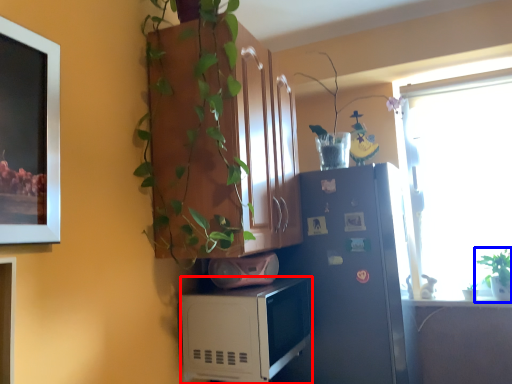
Question: Which of the following is the closest to the observer, microwave oven (highlighted by a red box) or houseplant (highlighted by a blue box)?

Choices:
 (A) microwave oven
 (B) houseplant

Answer: (A)